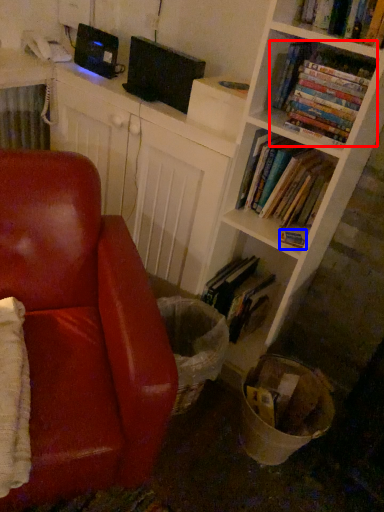
Question: Which object is closer to the camera taking this photo, book (highlighted by a red box) or book (highlighted by a blue box)?

Choices:
 (A) book
 (B) book

Answer: (A)